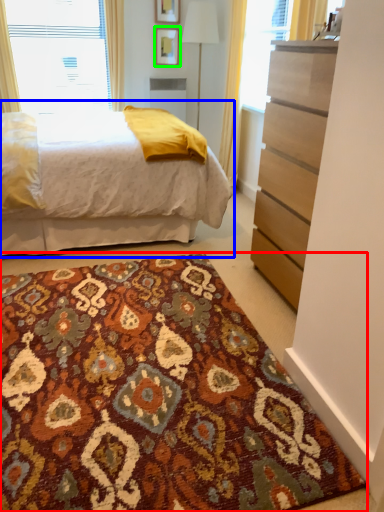
Question: Which is farther away from doormat (highlighted by a red box)? bed (highlighted by a blue box) or picture frame (highlighted by a green box)?

Choices:
 (A) bed
 (B) picture frame

Answer: (B)